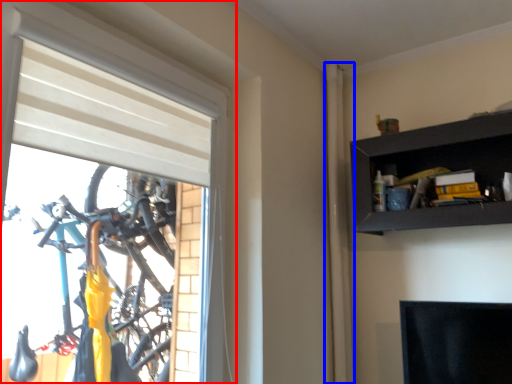
Question: Which object appears closest to the camera in this image, window (highlighted by a red box) or curtain (highlighted by a blue box)?

Choices:
 (A) window
 (B) curtain

Answer: (A)